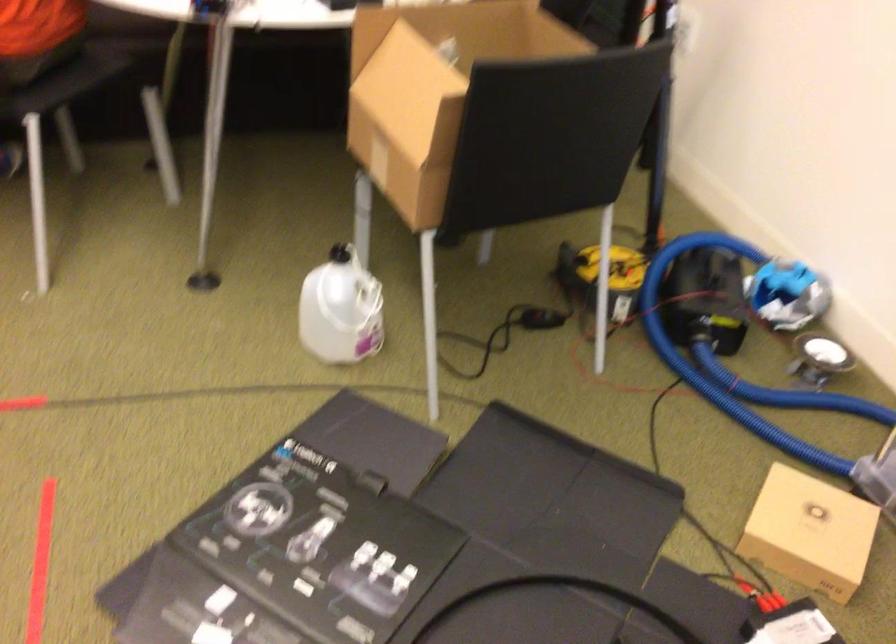
Where is `black steering wheel`? This screenshot has height=644, width=896. black steering wheel is located at coordinates (556, 601).